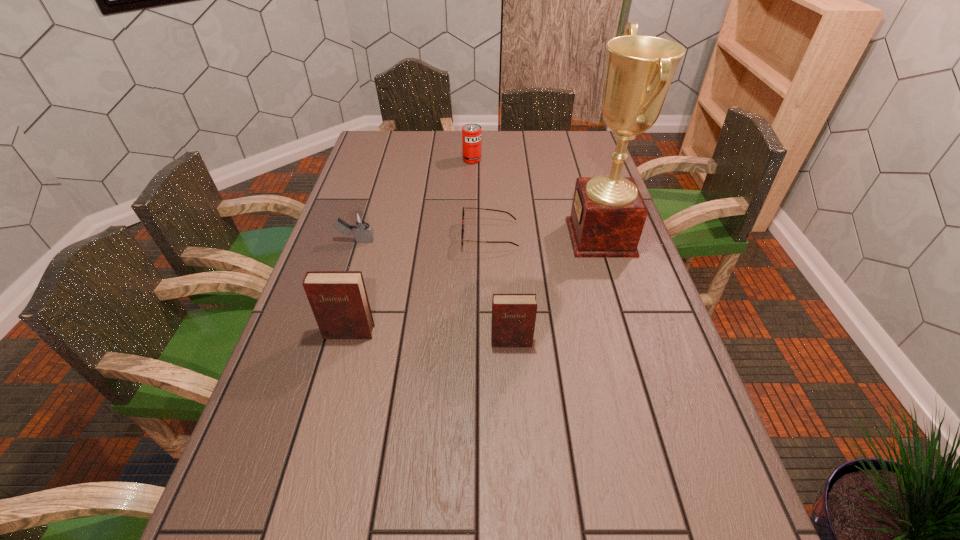
You are a GUI agent. You are given a task and a screenshot of the screen. Output one action in this format:
    pyautogui.click(x=<x>, y=<y>)
    Task: Click on the free point between the right diary and the can
    This screenshot has width=960, height=540.
    Given the screenshot: What is the action you would take?
    pyautogui.click(x=492, y=251)

You are a GUI agent. You are given a task and a screenshot of the screen. Output one action in this format:
    pyautogui.click(x=<x>, y=<y>)
    Task: Click on the vacant area between the farthest object and the fifth tallest object
    This screenshot has height=540, width=960.
    Given the screenshot: What is the action you would take?
    pyautogui.click(x=414, y=200)

Locate an element on the screen. free space between the rightmost object and the second shortest object is located at coordinates (478, 239).

Identify the location of vacant area that lies between the trophy cup and the shortest object. The image size is (960, 540). (545, 237).

Find the location of a particular element. The width and height of the screenshot is (960, 540). vacant area between the right diary and the spectacles is located at coordinates (501, 289).

The height and width of the screenshot is (540, 960). What are the coordinates of `empty space between the trophy cup and the shorter diary` in the screenshot? It's located at (556, 289).

Where is `empty space that is in between the shortest object and the igniter`? This screenshot has height=540, width=960. empty space that is in between the shortest object and the igniter is located at coordinates (422, 239).

Find the location of a particular element. This screenshot has height=540, width=960. free space that is in between the taller diary and the shorter diary is located at coordinates (430, 338).

Locate an element on the screen. empty location between the shorter diary and the shortest object is located at coordinates (501, 289).

Identify which object is the closest to the farthest object. Please provide its 2D coordinates. Your answer should be formatted as a tuple, i.e. [(x, y)], where the tuple contains the x and y coordinates of a point satisfying the conditions above.

[(462, 240)]